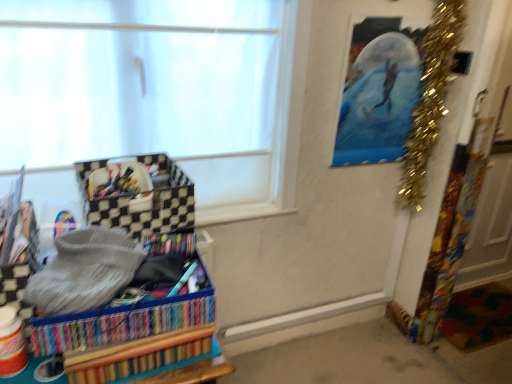
Question: Can we say metallic blue painting at upper right lies outside multicolored woven basket at lower left, acting as the 1th storage box starting from the bottom?

Choices:
 (A) no
 (B) yes

Answer: (B)

Question: Is metallic blue painting at upper right not close to multicolored woven basket at lower left, placed as the second storage box when sorted from top to bottom?

Choices:
 (A) yes
 (B) no

Answer: (A)

Question: From the image's perspective, is metallic blue painting at upper right located beneath multicolored woven basket at lower left, acting as the 1th storage box starting from the bottom?

Choices:
 (A) yes
 (B) no

Answer: (B)

Question: Is multicolored woven basket at lower left, acting as the 1th storage box starting from the bottom, a part of metallic blue painting at upper right?

Choices:
 (A) no
 (B) yes

Answer: (A)

Question: Is metallic blue painting at upper right next to multicolored woven basket at lower left, placed as the second storage box when sorted from top to bottom?

Choices:
 (A) yes
 (B) no

Answer: (B)

Question: Is multicolored woven basket at lower left, acting as the 1th storage box starting from the bottom, bigger or smaller than white matte window at upper left?

Choices:
 (A) big
 (B) small

Answer: (B)

Question: Is multicolored woven basket at lower left, acting as the 1th storage box starting from the bottom, situated inside white matte window at upper left or outside?

Choices:
 (A) outside
 (B) inside

Answer: (A)

Question: Is point (118, 332) positioned closer to the camera than point (243, 31)?

Choices:
 (A) farther
 (B) closer

Answer: (B)

Question: From their relative heights in the image, would you say multicolored woven basket at lower left, placed as the second storage box when sorted from top to bottom, is taller or shorter than white matte window at upper left?

Choices:
 (A) tall
 (B) short

Answer: (B)

Question: From the image's perspective, is black checkered storage box at left, the second storage box when ordered from bottom to top, located above or below multicolored woven basket at lower left, placed as the second storage box when sorted from top to bottom?

Choices:
 (A) above
 (B) below

Answer: (A)

Question: Do you think black checkered storage box at left, which appears as the first storage box when viewed from the top, is within multicolored woven basket at lower left, placed as the second storage box when sorted from top to bottom, or outside of it?

Choices:
 (A) inside
 (B) outside

Answer: (B)

Question: Is point coord(110,203) positioned closer to the camera than point coord(35,329)?

Choices:
 (A) farther
 (B) closer

Answer: (A)

Question: Looking at their shapes, would you say black checkered storage box at left, the second storage box when ordered from bottom to top, is wider or thinner than multicolored woven basket at lower left, acting as the 1th storage box starting from the bottom?

Choices:
 (A) thin
 (B) wide

Answer: (A)

Question: Is point pyautogui.click(x=441, y=72) closer or farther from the camera than point pyautogui.click(x=9, y=137)?

Choices:
 (A) closer
 (B) farther

Answer: (B)

Question: From the image's perspective, relative to white matte window at upper left, is gold tinsel garland at upper right above or below?

Choices:
 (A) above
 (B) below

Answer: (A)